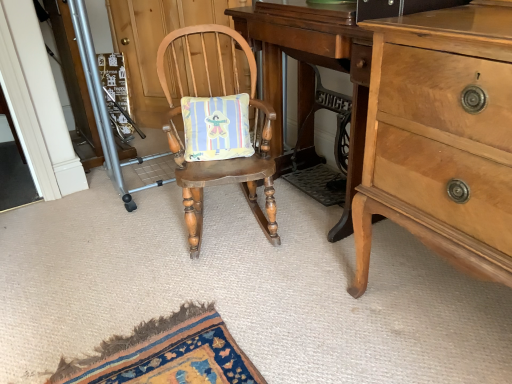
Locate an element on the screen. This screenshot has height=384, width=512. free point below wooden rocking chair at center (from a real-world perspective) is located at coordinates (232, 230).